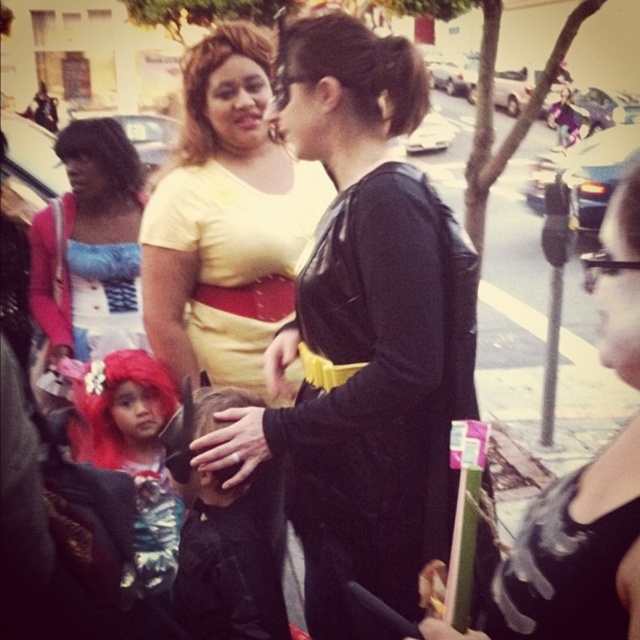
Question: Is black leather jacket at center further to the viewer compared to matte blue dress at left?

Choices:
 (A) no
 (B) yes

Answer: (A)

Question: Which of the following is the farthest from the observer?

Choices:
 (A) black leather jacket at center
 (B) matte blue dress at left
 (C) yellow matte dress at center

Answer: (B)

Question: Which point is closer to the camera?

Choices:
 (A) (64, 323)
 (B) (605, 324)
 (C) (188, 61)
 (D) (416, 356)

Answer: (B)

Question: Which point is farther to the camera?

Choices:
 (A) (525, 534)
 (B) (173, 252)

Answer: (B)

Question: Can you confirm if black leather purse at center is positioned below shiny red wig at lower left?

Choices:
 (A) yes
 (B) no

Answer: (B)

Question: Is yellow matte dress at center to the right of matte blue dress at left from the viewer's perspective?

Choices:
 (A) yes
 (B) no

Answer: (A)